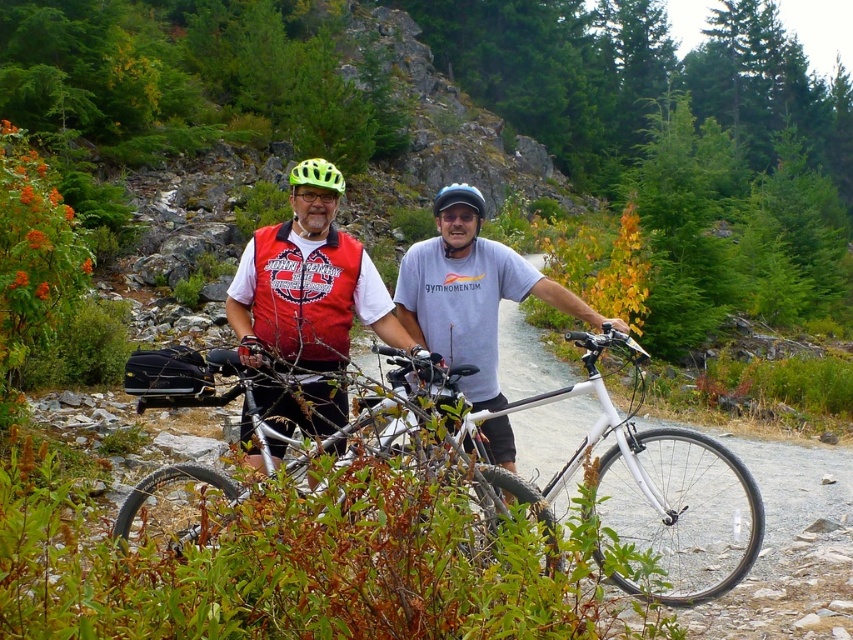
Question: Which point is closer to the camera taking this photo?

Choices:
 (A) (381, 452)
 (B) (306, 164)
 (C) (294, 200)
 (D) (714, 572)

Answer: (A)

Question: Does white matte mountain bike at center appear over matte black helmet at center?

Choices:
 (A) no
 (B) yes

Answer: (A)

Question: Among these points, which one is farthest from the camera?

Choices:
 (A) (325, 346)
 (B) (302, 236)
 (C) (314, 164)
 (D) (462, 192)

Answer: (D)

Question: From the image, what is the correct spatial relationship of green matte bicycle helmet at center in relation to matte black helmet at center?

Choices:
 (A) below
 (B) above

Answer: (A)

Question: Based on their relative distances, which object is farther from the silver metallic bicycle at center?

Choices:
 (A) matte red vest at center
 (B) matte black helmet at center
 (C) white matte mountain bike at center

Answer: (C)

Question: In this image, where is matte red vest at center located relative to silver metallic bicycle at center?

Choices:
 (A) above
 (B) below

Answer: (A)